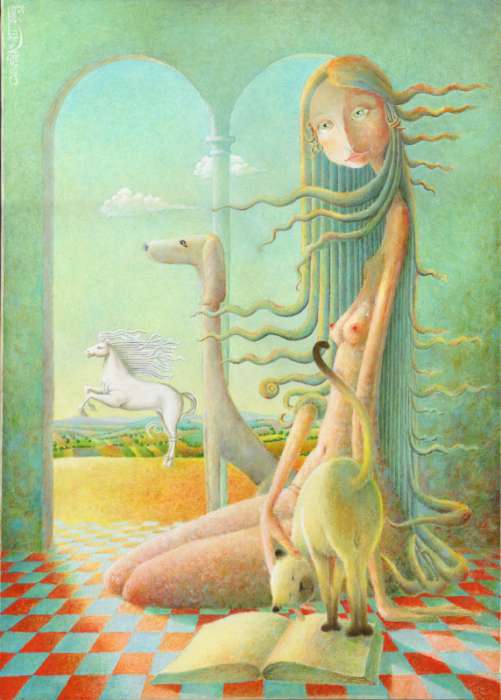
At what (x,y) coordinates should I click in order to perform the action: click on book. Please return your answer as a coordinate pair (x, y). Looking at the image, I should click on (312, 654).